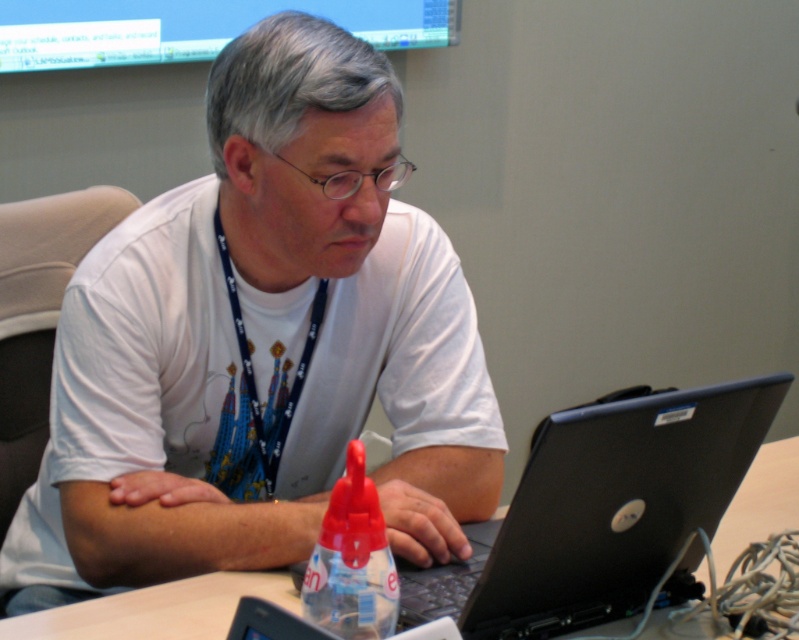
Who is taller, transparent plastic bottle at center or blue fabric lanyard at center?

Standing taller between the two is blue fabric lanyard at center.

Is transparent plastic bottle at center closer to the viewer compared to blue fabric lanyard at center?

Yes, transparent plastic bottle at center is closer to the viewer.

Does point (372, 518) lie behind point (324, 289)?

No, it is in front of (324, 289).

This screenshot has height=640, width=799. I want to click on transparent plastic bottle at center, so click(x=352, y=561).

Is black plastic laptop at center positioned in front of blue fabric lanyard at center?

Yes, it is in front of blue fabric lanyard at center.

Who is positioned more to the right, black plastic laptop at center or blue fabric lanyard at center?

black plastic laptop at center

Is point (571, 497) less distant than point (285, 419)?

Yes, point (571, 497) is closer to viewer.

Image resolution: width=799 pixels, height=640 pixels. I want to click on black plastic laptop at center, so click(x=599, y=512).

Which is above, white matte shirt at center or transparent plastic bottle at center?

white matte shirt at center is above.

Who is positioned more to the left, white matte shirt at center or transparent plastic bottle at center?

From the viewer's perspective, white matte shirt at center appears more on the left side.

The height and width of the screenshot is (640, 799). What are the coordinates of `white matte shirt at center` in the screenshot? It's located at (260, 346).